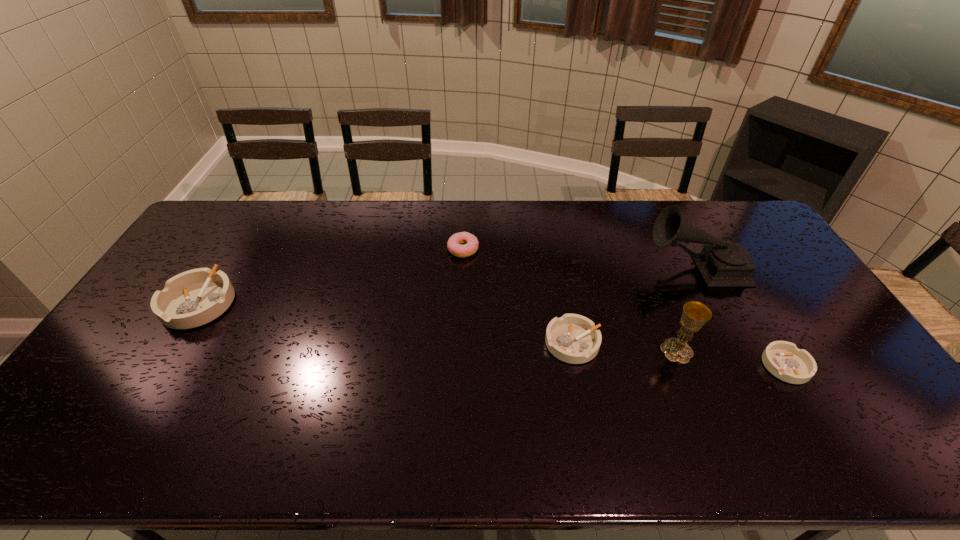
To achieve even spacing by inserting another ashtray among them, please point to a vacant spot for this new ashtray. Please provide its 2D coordinates. Your answer should be formatted as a tuple, i.e. [(x, y)], where the tuple contains the x and y coordinates of a point satisfying the conditions above.

[(378, 322)]